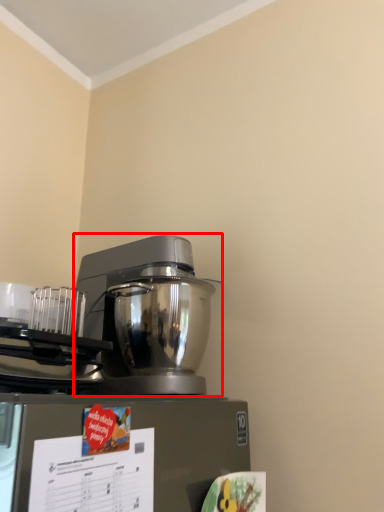
Question: From the image's perspective, where is mixer (annotated by the red box) located relative to appliance?

Choices:
 (A) below
 (B) above

Answer: (B)